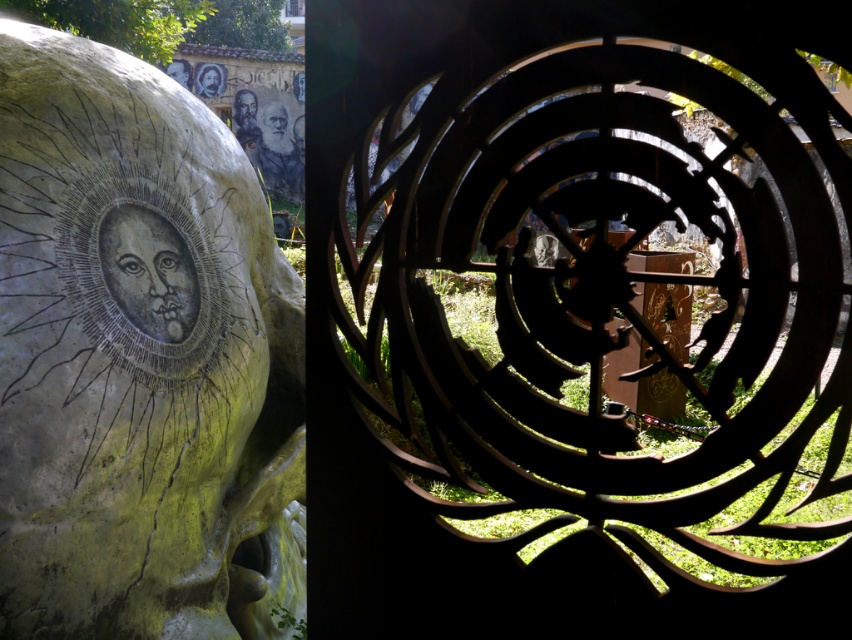
Question: Is matte stone face at center behind gray textured face at upper center?

Choices:
 (A) no
 (B) yes

Answer: (A)

Question: Which point appears farthest from the camera in this image?

Choices:
 (A) (223, 515)
 (B) (248, 118)

Answer: (B)

Question: Does matte stone face at center have a lesser width compared to gray textured face at upper center?

Choices:
 (A) yes
 (B) no

Answer: (A)

Question: Is gray textured face at upper center to the left of matte black face at upper center from the viewer's perspective?

Choices:
 (A) yes
 (B) no

Answer: (B)

Question: Which of the following is the closest to the observer?

Choices:
 (A) (251, 99)
 (B) (142, 300)

Answer: (B)

Question: Which point is closer to the camera?

Choices:
 (A) (240, 536)
 (B) (280, 147)
 (C) (164, 308)

Answer: (C)